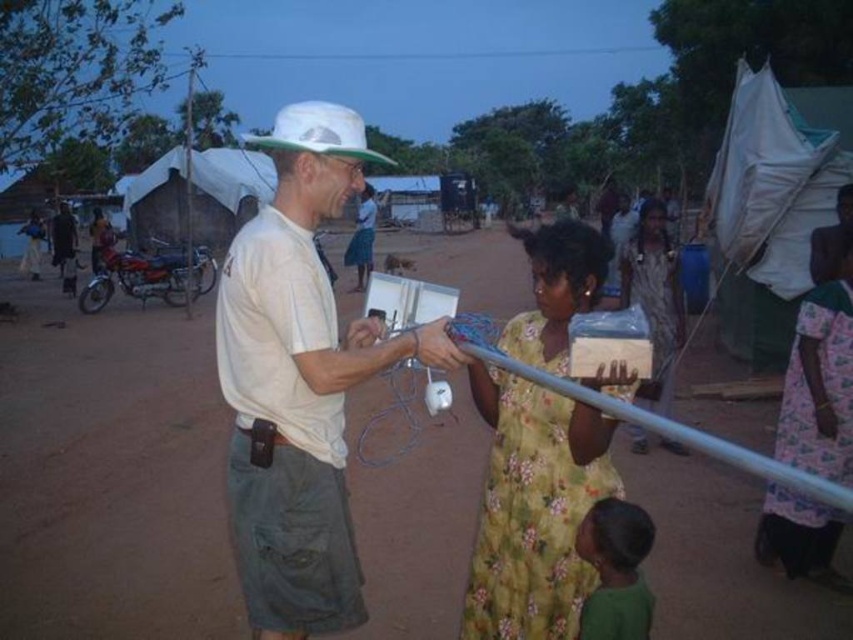
You are a photographer trying to capture a photo of the brown dirt field at center and the yellow floral dress at center. Based on their positions, which object should you focus on first to ensure both are in clear view?

The brown dirt field at center is taller than the yellow floral dress at center, so you should focus on the brown dirt field at center first to ensure both are in clear view.